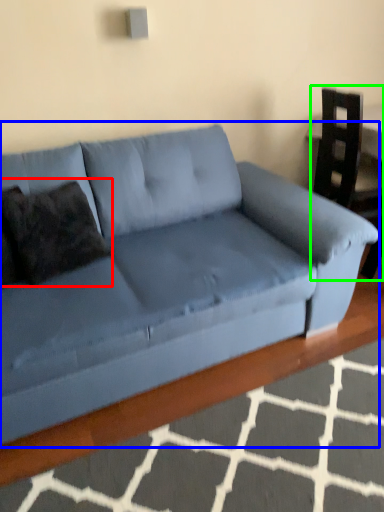
Question: Which is nearer to the pillow (highlighted by a red box)? studio couch (highlighted by a blue box) or armchair (highlighted by a green box).

Choices:
 (A) studio couch
 (B) armchair

Answer: (A)